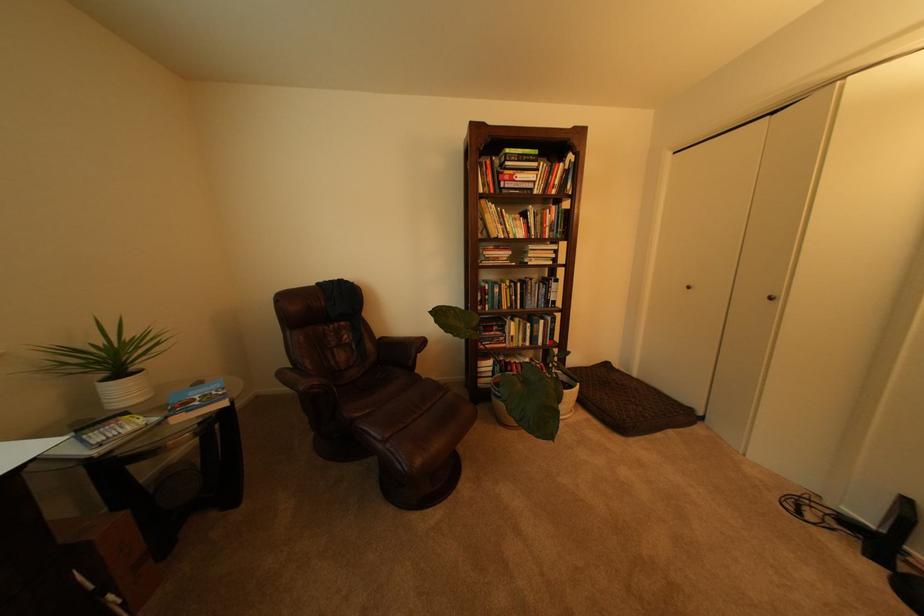
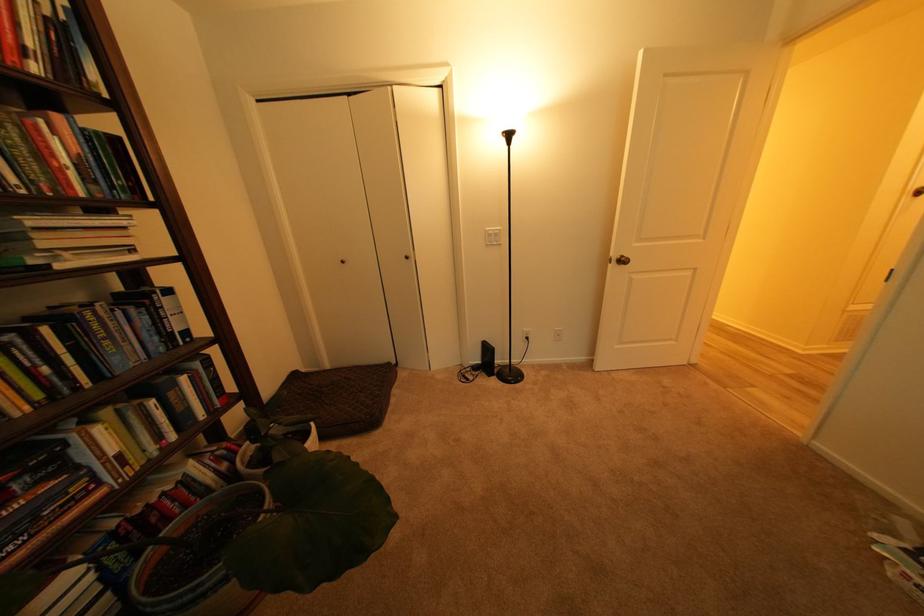
The point at (883, 528) is marked in the first image. Where is the corresponding point in the second image?

(490, 363)